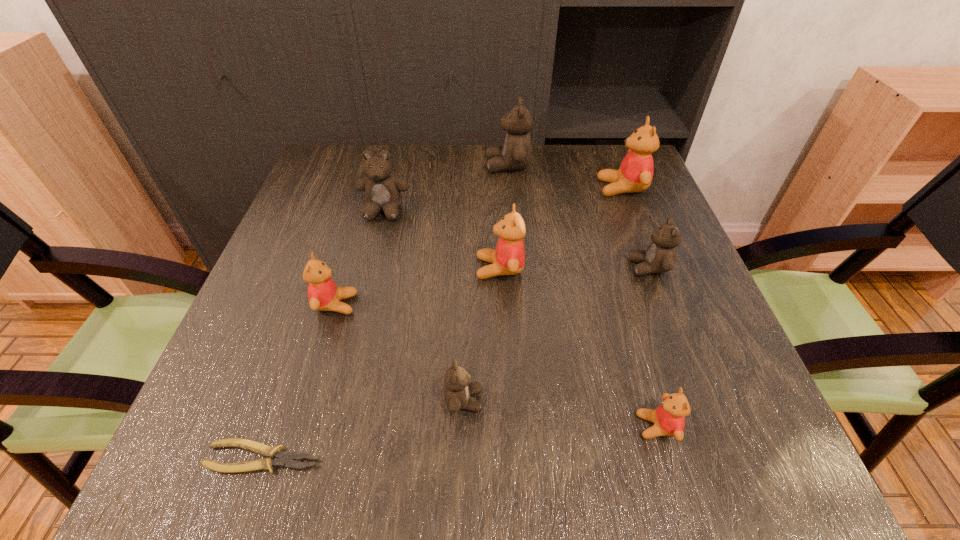
This screenshot has width=960, height=540. Identify the location of free space between the nearest brown teddy bear and the farthest brown teddy bear. (486, 283).

What are the coordinates of `vacant area between the shortest object and the second smallest red teddy bear` in the screenshot? It's located at (300, 381).

You are a GUI agent. You are given a task and a screenshot of the screen. Output one action in this format:
    pyautogui.click(x=<x>, y=<y>)
    Task: Click on the vacant area that lies between the farthest brown teddy bear and the third biggest red teddy bear
    Image resolution: width=960 pixels, height=540 pixels.
    Given the screenshot: What is the action you would take?
    pyautogui.click(x=421, y=235)

Select which object is the second closest to the second nearest brown teddy bear. Please provide its 2D coordinates. Your answer should be formatted as a tuple, i.e. [(x, y)], where the tuple contains the x and y coordinates of a point satisfying the conditions above.

[(508, 258)]

Find the location of a particular element. object that ranks as the closest to the second red teddy bear from left to right is located at coordinates (382, 189).

Locate which teddy bear is the third closest to the farthest brown teddy bear. Please provide its 2D coordinates. Your answer should be formatted as a tuple, i.e. [(x, y)], where the tuple contains the x and y coordinates of a point satisfying the conditions above.

[(508, 258)]

I want to click on teddy bear that is the fifth closest to the third brown teddy bear from left to right, so pyautogui.click(x=323, y=294).

Select which brown teddy bear is the second closest to the farthest red teddy bear. Please provide its 2D coordinates. Your answer should be formatted as a tuple, i.e. [(x, y)], where the tuple contains the x and y coordinates of a point satisfying the conditions above.

[(515, 154)]

Identify the location of brown teddy bear that is the second nearest to the third red teddy bear from right to left. (458, 387).

Locate which red teddy bear is the fourth closest to the third brown teddy bear from right to left. Please provide its 2D coordinates. Your answer should be formatted as a tuple, i.e. [(x, y)], where the tuple contains the x and y coordinates of a point satisfying the conditions above.

[(635, 174)]